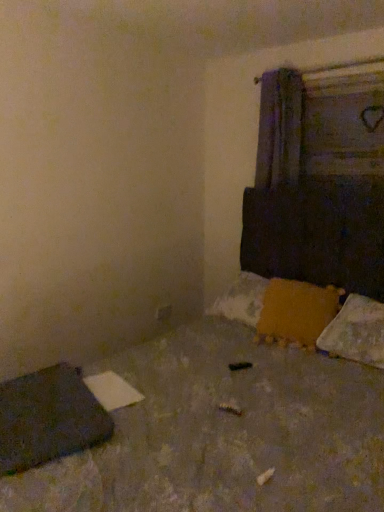
Question: Is dark gray fabric at lower left bigger than white fluffy pillow at lower right, which is the second pillow from left to right?

Choices:
 (A) yes
 (B) no

Answer: (B)

Question: Can you confirm if dark gray fabric at lower left is thinner than white fluffy pillow at lower right, which is counted as the 1th pillow, starting from the right?

Choices:
 (A) no
 (B) yes

Answer: (B)

Question: Is dark gray fabric at lower left taller than white fluffy pillow at lower right, which is the second pillow from left to right?

Choices:
 (A) no
 (B) yes

Answer: (A)

Question: Is the position of dark gray fabric at lower left less distant than that of white fluffy pillow at lower right, which is the second pillow from left to right?

Choices:
 (A) no
 (B) yes

Answer: (B)

Question: Considering the relative positions of dark gray fabric at lower left and white fluffy pillow at lower right, which is counted as the 1th pillow, starting from the right, in the image provided, is dark gray fabric at lower left to the right of white fluffy pillow at lower right, which is counted as the 1th pillow, starting from the right, from the viewer's perspective?

Choices:
 (A) no
 (B) yes

Answer: (A)

Question: Is orange fuzzy pillow at lower right, the 2th pillow from the right, taller or shorter than white fluffy pillow at lower right, which is the second pillow from left to right?

Choices:
 (A) tall
 (B) short

Answer: (A)

Question: From the image's perspective, relative to white fluffy pillow at lower right, which is counted as the 1th pillow, starting from the right, is orange fuzzy pillow at lower right, the 2th pillow from the right, above or below?

Choices:
 (A) above
 (B) below

Answer: (A)

Question: Looking at the image, does orange fuzzy pillow at lower right, the 2th pillow from the right, seem bigger or smaller compared to white fluffy pillow at lower right, which is the second pillow from left to right?

Choices:
 (A) big
 (B) small

Answer: (A)

Question: Does point (291, 313) appear closer or farther from the camera than point (365, 361)?

Choices:
 (A) farther
 (B) closer

Answer: (A)

Question: Is concrete textured floor at lower left in front of or behind orange fuzzy pillow at lower right, the 2th pillow from the right, in the image?

Choices:
 (A) front
 (B) behind

Answer: (A)

Question: From the image's perspective, is concrete textured floor at lower left above or below orange fuzzy pillow at lower right, the 2th pillow from the right?

Choices:
 (A) above
 (B) below

Answer: (B)

Question: Is point (274, 375) positioned closer to the camera than point (336, 302)?

Choices:
 (A) closer
 (B) farther

Answer: (A)

Question: From a real-world perspective, relative to orange fuzzy pillow at lower right, the 2th pillow from the right, is concrete textured floor at lower left vertically above or below?

Choices:
 (A) below
 (B) above

Answer: (A)

Question: Does point (152, 467) appear closer or farther from the camera than point (54, 376)?

Choices:
 (A) closer
 (B) farther

Answer: (A)

Question: From their relative heights in the image, would you say concrete textured floor at lower left is taller or shorter than dark gray fabric at lower left?

Choices:
 (A) tall
 (B) short

Answer: (A)